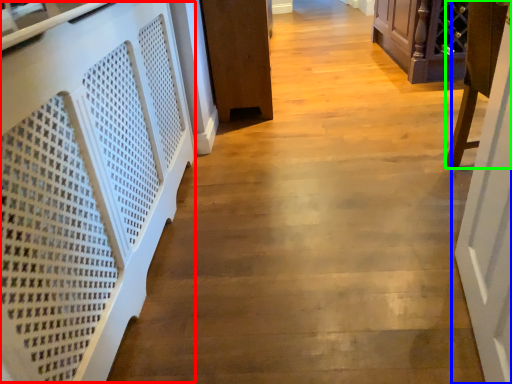
Question: Considering the real-world distances, which object is closest to stairwell (highlighted by a red box)? door (highlighted by a blue box) or furniture (highlighted by a green box).

Choices:
 (A) door
 (B) furniture

Answer: (A)